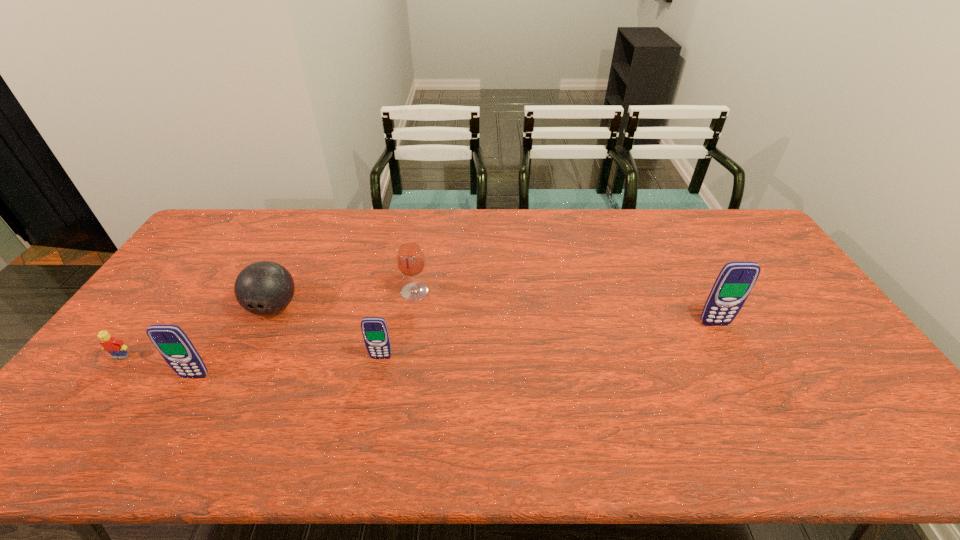
Please point a location where one more cellular_telephone can be added evenly. Please provide its 2D coordinates. Your answer should be formatted as a tuple, i.e. [(x, y)], where the tuple contains the x and y coordinates of a point satisfying the conditions above.

[(554, 340)]